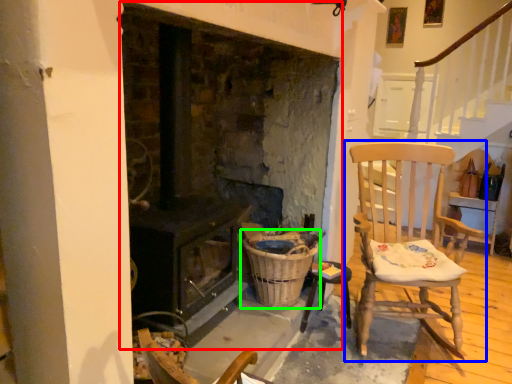
Question: Based on their relative distances, which object is nearer to fireplace (highlighted by a red box)? Choose from chair (highlighted by a blue box) and basket (highlighted by a green box).

Choices:
 (A) chair
 (B) basket

Answer: (B)